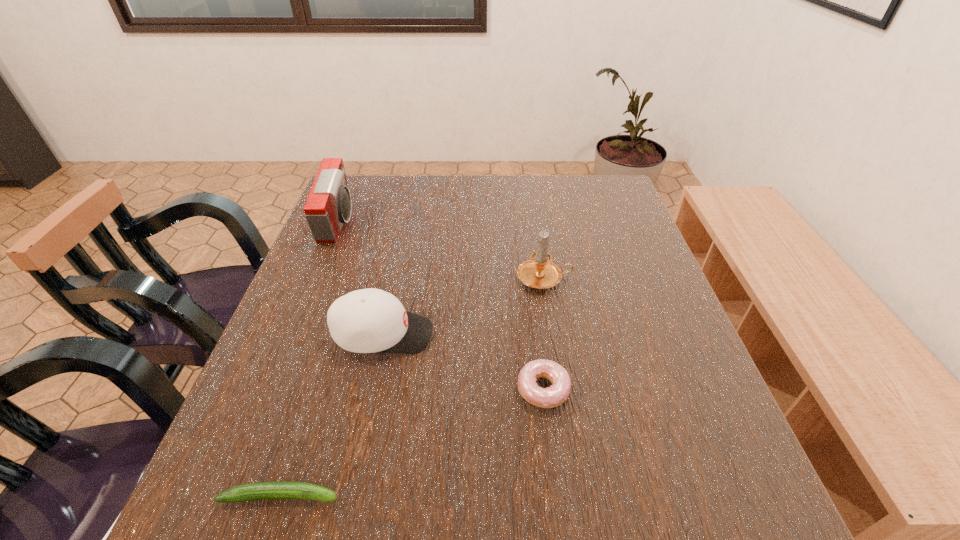
Image resolution: width=960 pixels, height=540 pixels. I want to click on vacant region at the far edge of the desktop, so [428, 205].

This screenshot has height=540, width=960. I want to click on free space at the left edge, so click(255, 418).

Identify the location of vacant space at the right edge of the desktop. (726, 458).

Image resolution: width=960 pixels, height=540 pixels. What are the coordinates of `free space at the far right corner of the desktop` in the screenshot? It's located at (592, 209).

The height and width of the screenshot is (540, 960). What are the coordinates of `vacant space at the near right corner of the desktop` in the screenshot? It's located at point(681,510).

Where is `free space between the second nearest object and the candle`? free space between the second nearest object and the candle is located at coordinates (543, 334).

I want to click on empty location between the third shortest object and the candle, so point(464,307).

Where is `free space that is in between the nearest object and the baseball cap`? free space that is in between the nearest object and the baseball cap is located at coordinates (332, 415).

Locate an element on the screen. vacant point located between the doughnut and the zucchini is located at coordinates (412, 443).

Locate an element on the screen. The width and height of the screenshot is (960, 540). vacant point located between the third tallest object and the camera is located at coordinates (361, 279).